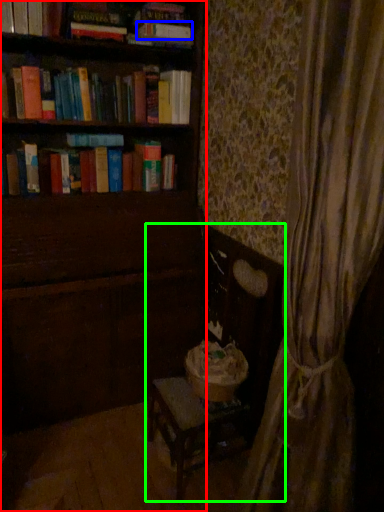
Question: Which object is the closest to the furniture (highlighted by a red box)? Choose among these: paperback book (highlighted by a blue box) or rocking chair (highlighted by a green box).

Choices:
 (A) paperback book
 (B) rocking chair

Answer: (B)